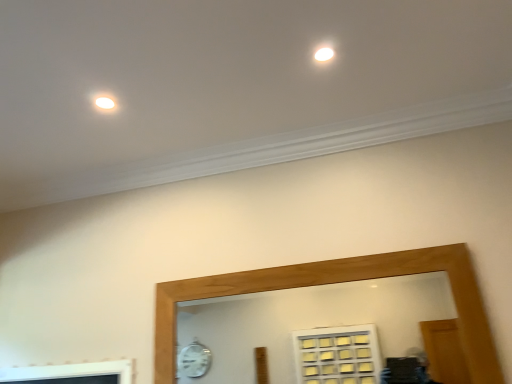
What do you see at coordinates (312, 327) in the screenshot? Image resolution: width=512 pixels, height=384 pixels. I see `wooden mirror at center` at bounding box center [312, 327].

Where is `wooden mirror at center`? wooden mirror at center is located at coordinates (312, 327).

In order to face wooden mirror at center, should I rotate leftwards or rightwards?

You should look right and rotate roughly 6.380 degrees.

In order to click on wooden mirror at center in this screenshot , I will do `click(312, 327)`.